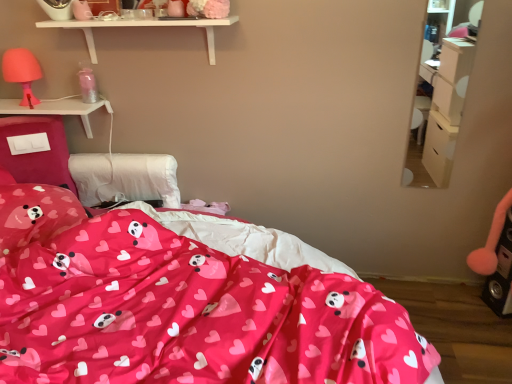
Locate an element on the screen. vacant area on top of white plastic switch at left (from a real-world perspective) is located at coordinates (52, 105).